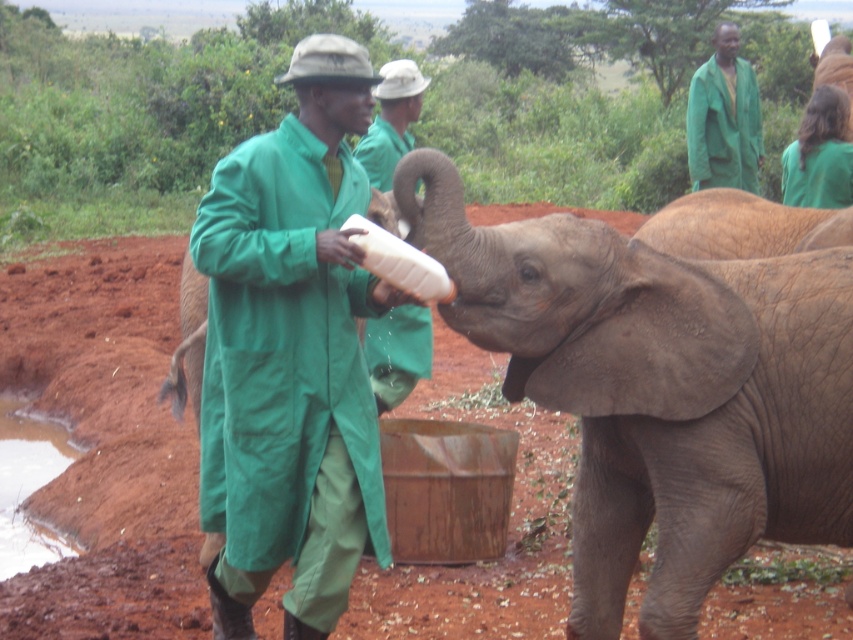
Question: Is gray textured elephant at center below green fabric coat at center?

Choices:
 (A) yes
 (B) no

Answer: (B)

Question: Observing the image, what is the correct spatial positioning of green matte coat at center in reference to gray matte elephant at right?

Choices:
 (A) left
 (B) right

Answer: (A)

Question: Which object appears farthest from the camera in this image?

Choices:
 (A) green fabric coat at center
 (B) gray matte elephant at right
 (C) gray textured elephant at center
 (D) green fabric coat at upper right

Answer: (D)

Question: Observing the image, what is the correct spatial positioning of gray textured elephant at center in reference to green matte coat at center?

Choices:
 (A) left
 (B) right

Answer: (B)

Question: Among these objects, which one is farthest from the camera?

Choices:
 (A) gray textured elephant at center
 (B) gray matte elephant at right
 (C) green matte coat at center
 (D) green fabric coat at upper right

Answer: (D)

Question: Which of these objects is positioned farthest from the green fabric coat at center?

Choices:
 (A) green fabric coat at upper right
 (B) green matte coat at center
 (C) gray textured elephant at center

Answer: (A)